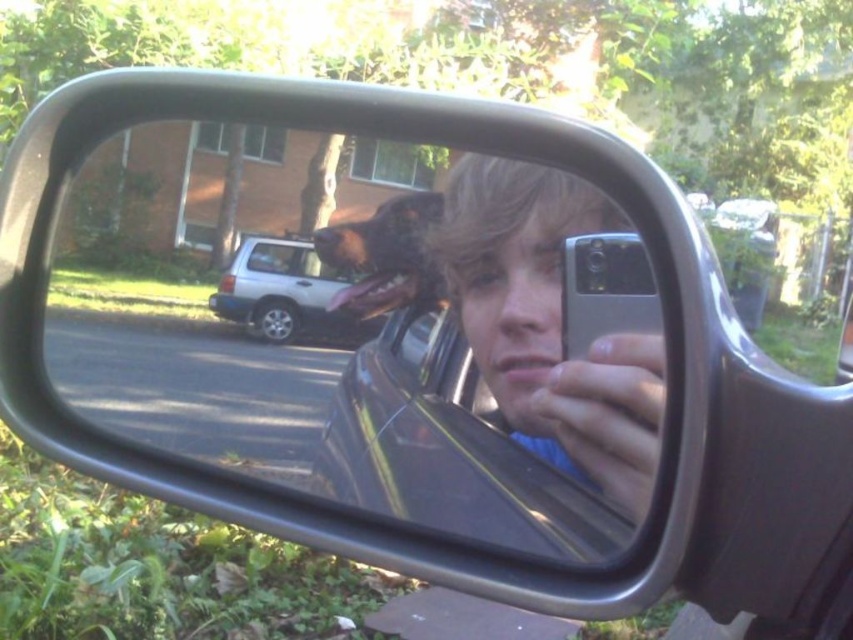
You are a passenger in the car and want to take a photo of the white matte suv at center through the side mirror. However, the matte silver phone at center is blocking the view. Can you move the phone to the side to capture the SUV in the mirror?

The matte silver phone at center is in front of white matte suv at center, so moving the phone to the side would allow the SUV to be visible in the mirror.

You are a delivery person trying to locate the brown furry dog at center in the image shown through the car side mirror. According to the coordinates provided, where exactly is the dog positioned?

The brown furry dog at center is located at point 0.402 on the x axis and 0.453 on the y axis.

You are a delivery driver who needs to check the distance between the white matte suv at center and the clear glass car window at center to ensure your package can fit. Can you confirm if the space is sufficient if the package measures 1.5 inches in width?

The distance between the white matte suv at center and the clear glass car window at center is 0.73 inches, which is narrower than the 1.5 inches package. Therefore, the package cannot fit through the space.